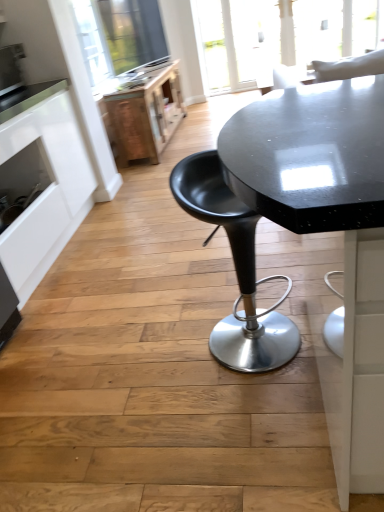
Question: Is white matte cabinet at left further to camera compared to wooden file cabinet at upper left?

Choices:
 (A) no
 (B) yes

Answer: (A)

Question: Considering the relative sizes of white matte cabinet at left and wooden file cabinet at upper left in the image provided, is white matte cabinet at left thinner than wooden file cabinet at upper left?

Choices:
 (A) yes
 (B) no

Answer: (B)

Question: Are white matte cabinet at left and wooden file cabinet at upper left beside each other?

Choices:
 (A) yes
 (B) no

Answer: (B)

Question: Is white matte cabinet at left oriented towards wooden file cabinet at upper left?

Choices:
 (A) yes
 (B) no

Answer: (B)

Question: From a real-world perspective, is white matte cabinet at left over wooden file cabinet at upper left?

Choices:
 (A) yes
 (B) no

Answer: (A)

Question: Is white matte cabinet at left facing away from wooden file cabinet at upper left?

Choices:
 (A) yes
 (B) no

Answer: (B)

Question: Considering the relative sizes of black plastic stool at center and wooden file cabinet at upper left in the image provided, is black plastic stool at center wider than wooden file cabinet at upper left?

Choices:
 (A) yes
 (B) no

Answer: (B)

Question: Is black plastic stool at center facing towards wooden file cabinet at upper left?

Choices:
 (A) no
 (B) yes

Answer: (A)

Question: Can you confirm if black plastic stool at center is positioned to the right of wooden file cabinet at upper left?

Choices:
 (A) yes
 (B) no

Answer: (A)

Question: Is black plastic stool at center shorter than wooden file cabinet at upper left?

Choices:
 (A) yes
 (B) no

Answer: (B)

Question: Can we say black plastic stool at center lies outside wooden file cabinet at upper left?

Choices:
 (A) yes
 (B) no

Answer: (A)

Question: Is black plastic stool at center facing away from wooden file cabinet at upper left?

Choices:
 (A) yes
 (B) no

Answer: (B)

Question: Is black plastic stool at center positioned with its back to satin silver toaster at upper left?

Choices:
 (A) yes
 (B) no

Answer: (A)